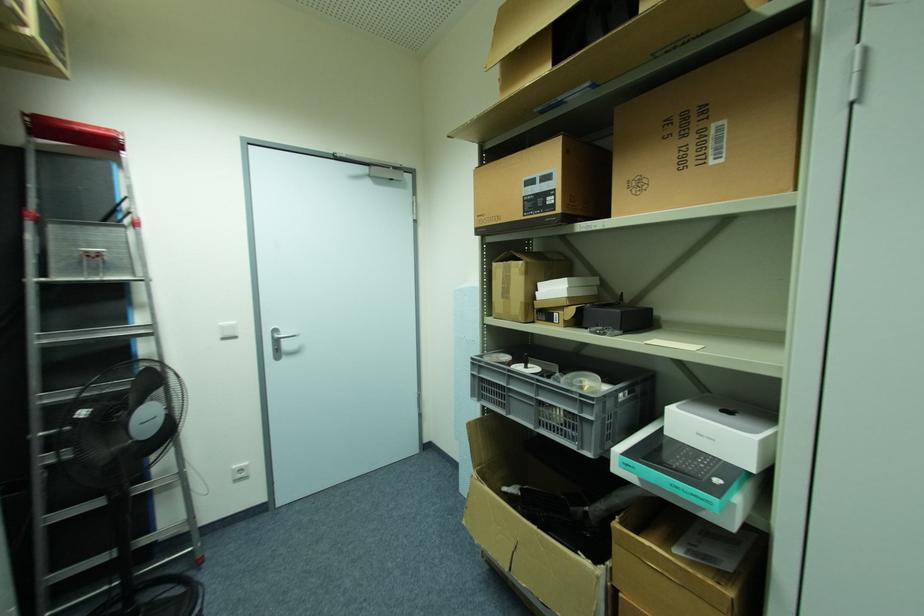
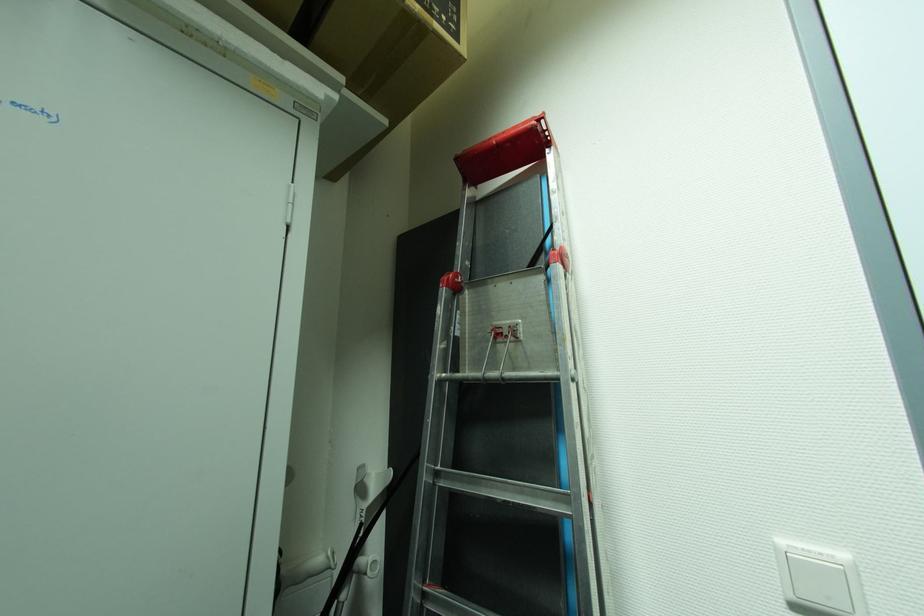
The point at (124,150) is marked in the first image. Where is the corresponding point in the second image?

(551, 144)